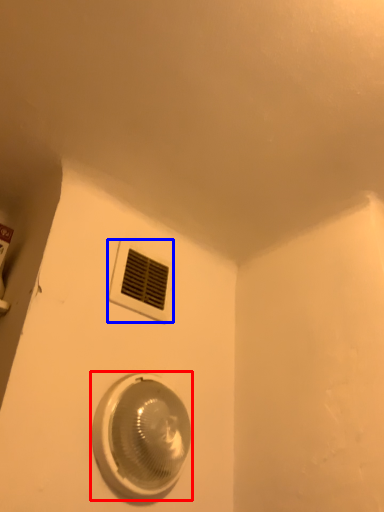
Question: Among these objects, which one is farthest to the camera, home appliance (highlighted by a red box) or window (highlighted by a blue box)?

Choices:
 (A) home appliance
 (B) window

Answer: (B)